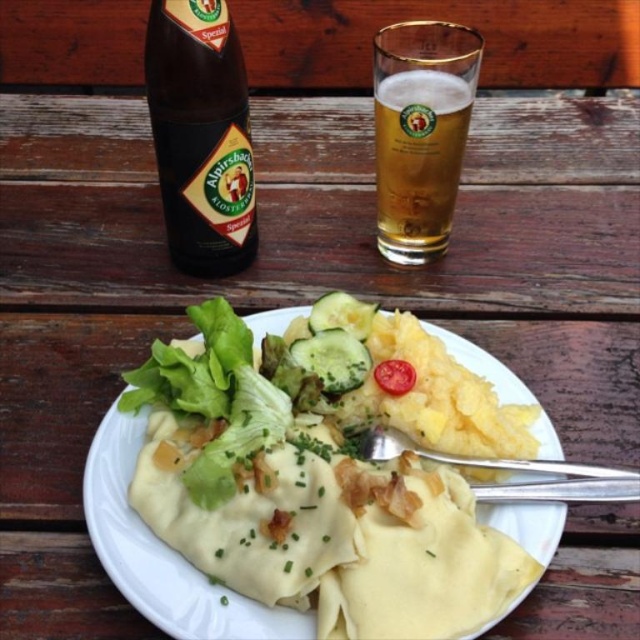
You are a food critic evaluating the presentation of this meal. Based on the height of the white creamy dumplings at center and the golden glass beer at upper center, which one appears taller?

The white creamy dumplings at center appear taller than the golden glass beer at upper center.

You are a food photographer setting up a shot for a magazine. You want to place a decorative napkin between the dark brown glass bottle at upper left and the red smooth tomato at plate center. If the napkin is 4 inches wide, will it fit without overlapping either object?

Answer: The distance between the dark brown glass bottle at upper left and the red smooth tomato at plate center is 9.29 inches. Since the napkin is 4 inches wide, it will fit between them without overlapping as there is enough space.